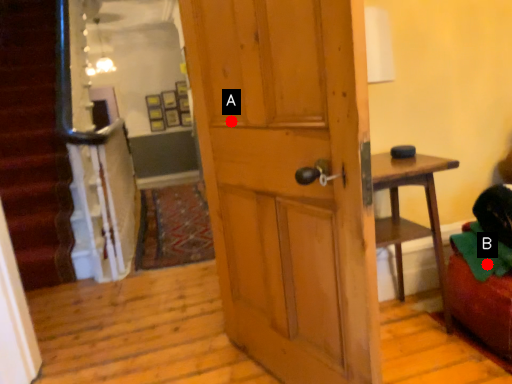
Question: Two points are circled on the image, labeled by A and B beside each circle. Which point is further to the camera?

Choices:
 (A) A is further
 (B) B is further

Answer: (B)